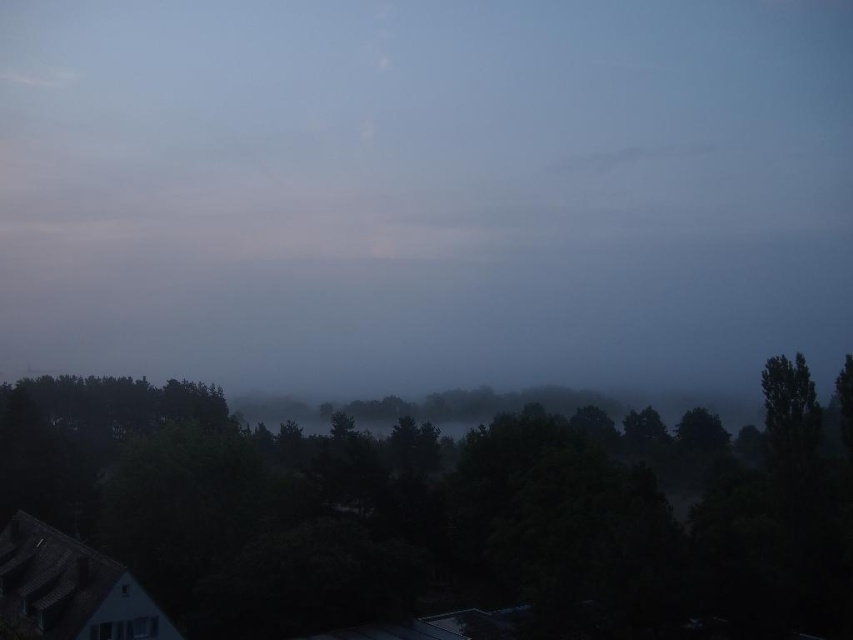
You are an artist trying to capture this scene. You want to ensure the transparent mist at center and the green matte tree at right are proportionally accurate. Which object should you draw taller in your painting?

The transparent mist at center has a greater height compared to the green matte tree at right, so you should draw the transparent mist at center taller than the green matte tree at right in your painting.